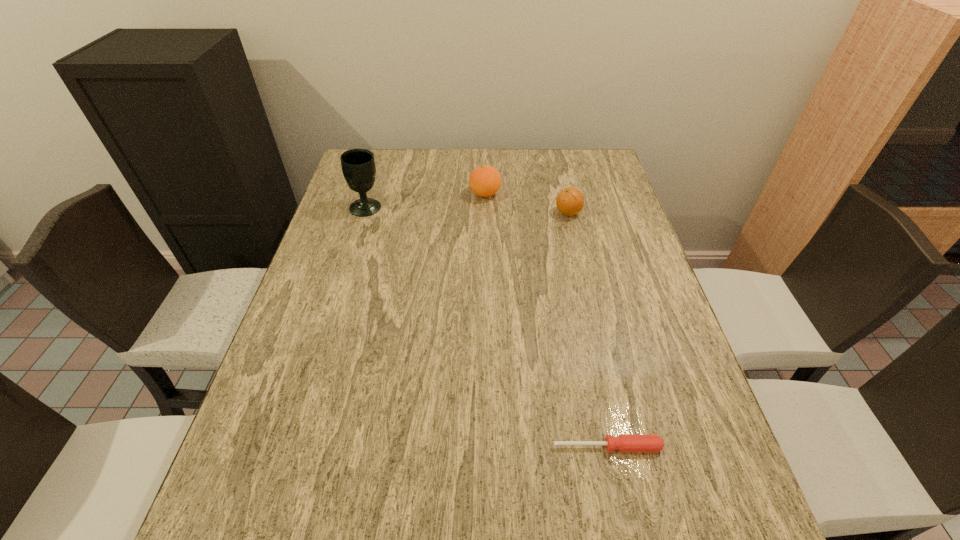
Where is `the tallest object`? The width and height of the screenshot is (960, 540). the tallest object is located at coordinates (358, 166).

The image size is (960, 540). I want to click on chalice, so click(358, 166).

Find the location of a particular element. the left orange is located at coordinates (484, 181).

At what (x,y) coordinates should I click in order to perform the action: click on the third shortest object. Please return your answer as a coordinate pair (x, y). This screenshot has height=540, width=960. Looking at the image, I should click on (484, 181).

The height and width of the screenshot is (540, 960). What are the coordinates of `the second shortest object` in the screenshot? It's located at (570, 201).

Image resolution: width=960 pixels, height=540 pixels. I want to click on the nearer orange, so click(x=570, y=201).

Identify the location of the shortest object. (625, 443).

Locate an element on the screen. The height and width of the screenshot is (540, 960). the nearest object is located at coordinates (625, 443).

Where is `vacant area located on the back of the chalice`? The width and height of the screenshot is (960, 540). vacant area located on the back of the chalice is located at coordinates (382, 156).

Identify the location of vacant area located 0.340m on the right of the left orange. The width and height of the screenshot is (960, 540). (608, 194).